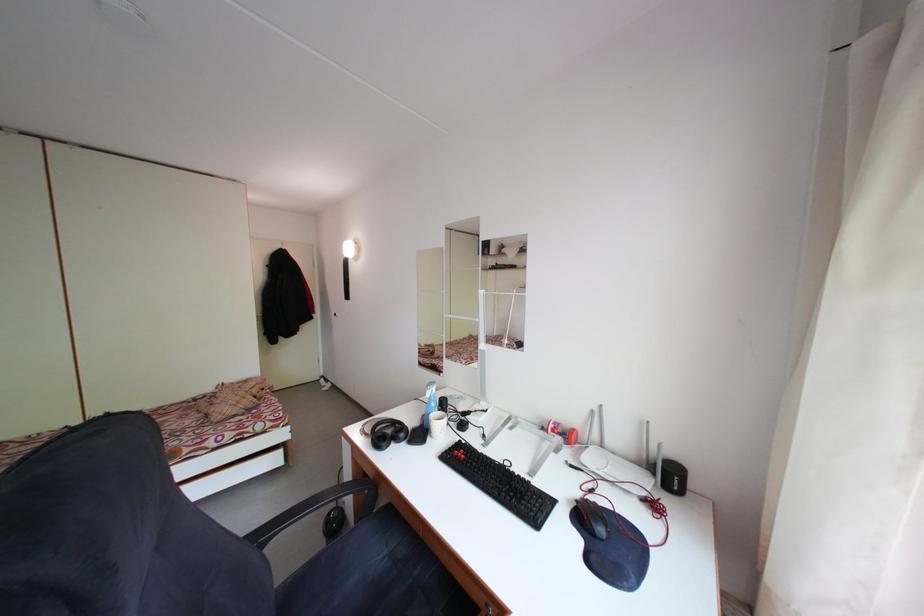
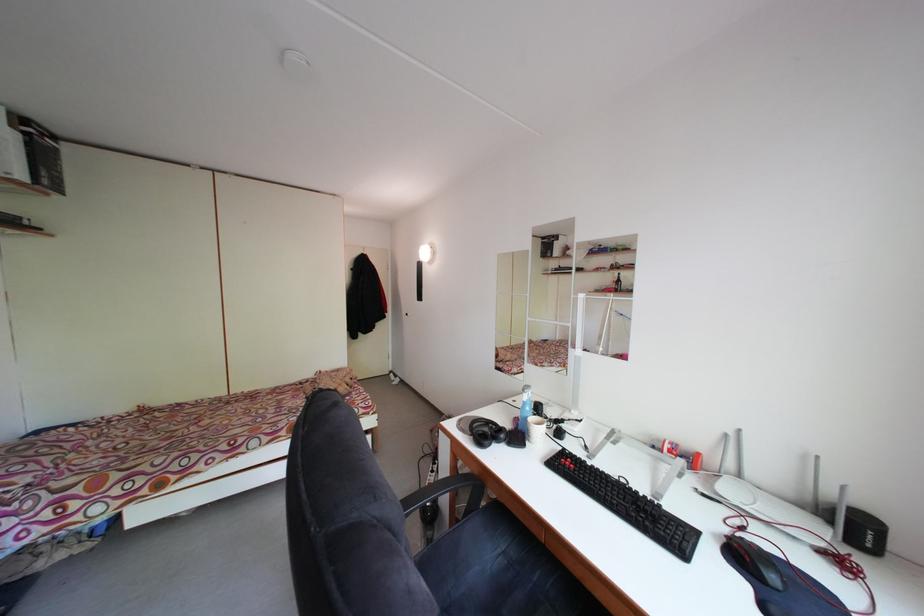
Find the pixel in the second image that matches pixel 394 560 in the first image.

(507, 557)